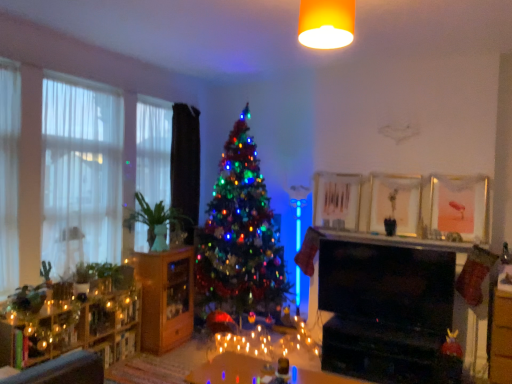
You are a GUI agent. You are given a task and a screenshot of the screen. Output one action in this format:
    pyautogui.click(x=<x>, y=<y>)
    Task: Click on the vacant area on top of metallic gold picture frame at upper center, which ranks as the second picture frame in right-to-left order (from a real-world perspective)
    This screenshot has height=384, width=512.
    Given the screenshot: What is the action you would take?
    pyautogui.click(x=395, y=166)